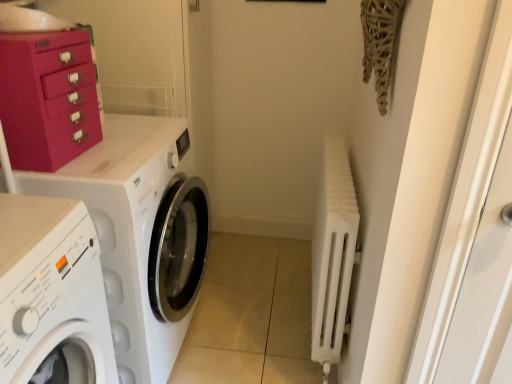
Find the location of `free space behind white matte radiator at right`. free space behind white matte radiator at right is located at coordinates (270, 272).